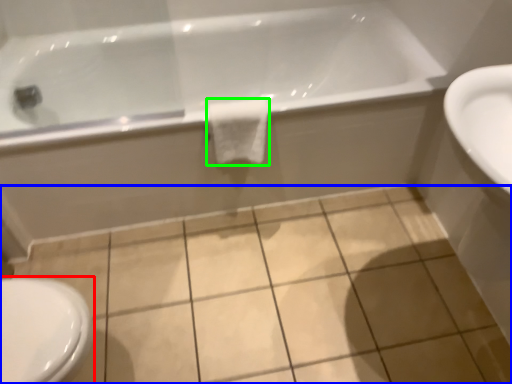
Question: Which object is the closest to the bidet (highlighted by a red box)? Choose among these: ceramic tile (highlighted by a blue box) or bath towel (highlighted by a green box).

Choices:
 (A) ceramic tile
 (B) bath towel

Answer: (A)